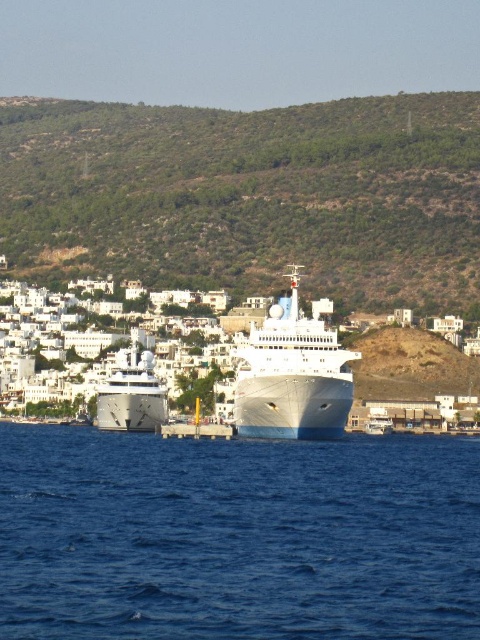
Does white glossy cruise ship at center have a larger size compared to white glossy boat at center?

Correct, white glossy cruise ship at center is larger in size than white glossy boat at center.

Which of these two, white glossy cruise ship at center or white glossy boat at center, stands shorter?

Standing shorter between the two is white glossy boat at center.

Is point (336, 435) less distant than point (379, 410)?

Yes.

Where is `white glossy cruise ship at center`? The width and height of the screenshot is (480, 640). white glossy cruise ship at center is located at coordinates (292, 374).

Which is in front, point (20, 314) or point (388, 428)?

Point (388, 428)

Looking at this image, is white matte building at center to the left of white glossy boat at center from the viewer's perspective?

Yes, white matte building at center is to the left of white glossy boat at center.

Find the location of a particular element. The image size is (480, 640). white matte building at center is located at coordinates (312, 369).

Between blue liquid water at center and white matte building at center, which one is positioned higher?

white matte building at center

Does blue liquid water at center have a lesser width compared to white matte building at center?

Correct, blue liquid water at center's width is less than white matte building at center's.

Which is behind, point (446, 577) or point (120, 388)?

The point (120, 388) is more distant.

Identify the location of blue liquid water at center. Image resolution: width=480 pixels, height=640 pixels. (237, 538).